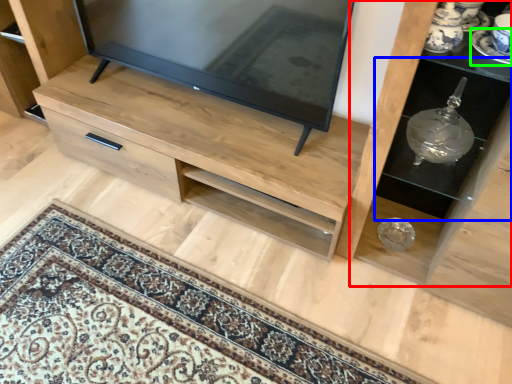
Question: Estimate the real-world distances between objects in this image. Which object is farther from shelf (highlighted by a red box), shelf (highlighted by a blue box) or saucer (highlighted by a green box)?

Choices:
 (A) shelf
 (B) saucer

Answer: (B)